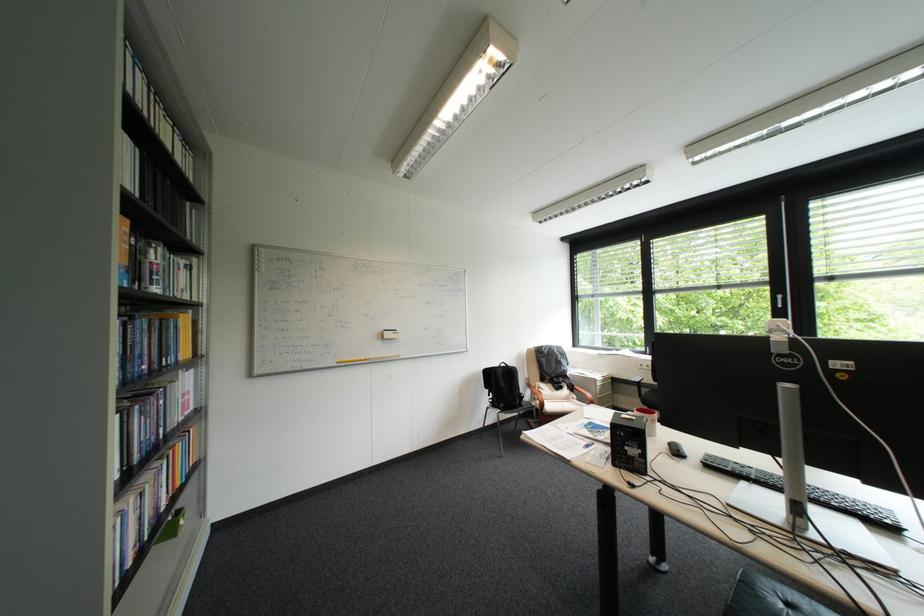
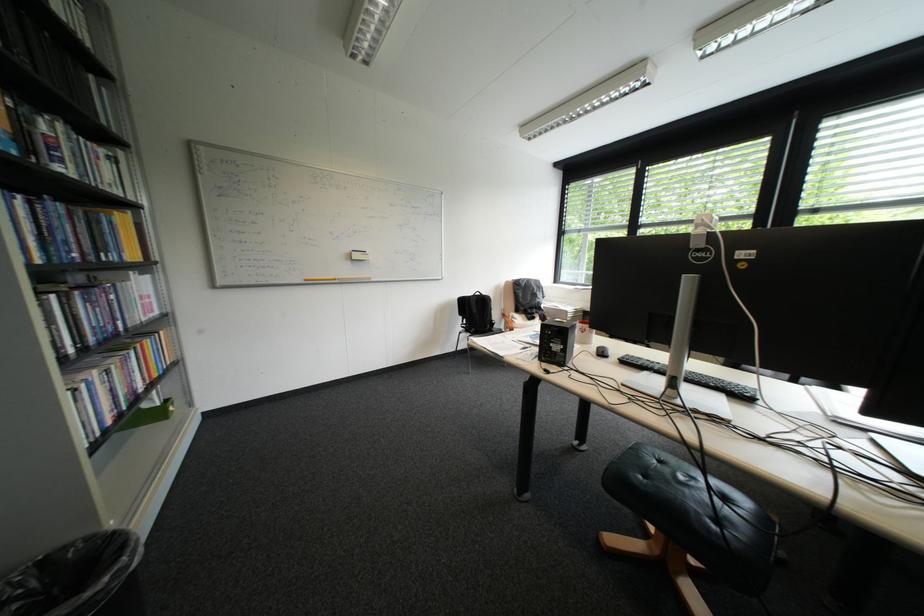
Question: The images are taken continuously from a first-person perspective. In which direction is your viewpoint rotating?

Choices:
 (A) Left
 (B) Right
 (C) Up
 (D) Down

Answer: (D)